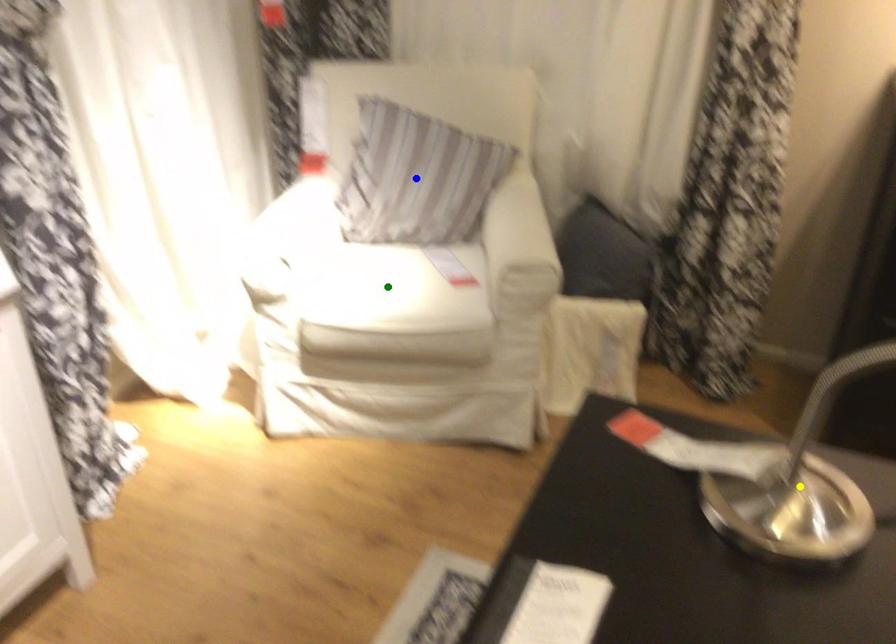
In the scene shown: Order these from nearest to farthest:
yellow point
green point
blue point

1. blue point
2. green point
3. yellow point